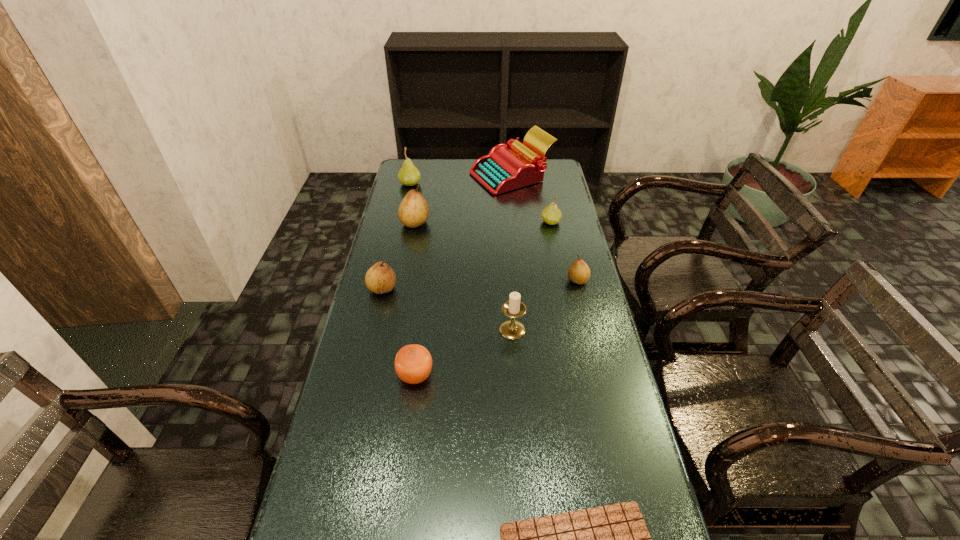
The height and width of the screenshot is (540, 960). Identify the location of orange orange. (413, 363).

Locate an element on the screen. the shortest pear is located at coordinates coord(579,272).

Where is `the rightmost brown pear`? The height and width of the screenshot is (540, 960). the rightmost brown pear is located at coordinates (579, 272).

This screenshot has width=960, height=540. In order to click on free location located 0.200m on the typing side of the typewriter in this screenshot , I will do `click(426, 176)`.

The image size is (960, 540). I want to click on free space located 0.130m on the typing side of the typewriter, so click(441, 176).

Find the location of `free space located on the typing side of the typewriter`. free space located on the typing side of the typewriter is located at coordinates (413, 176).

Find the location of a particular element. Image resolution: width=960 pixels, height=540 pixels. free spot located 0.140m on the back of the biggest brown pear is located at coordinates (420, 196).

Where is `vacant point located on the right of the left green pear`? This screenshot has height=540, width=960. vacant point located on the right of the left green pear is located at coordinates point(508,184).

Where is `free space located on the right of the white candle holder`? This screenshot has width=960, height=540. free space located on the right of the white candle holder is located at coordinates (559, 330).

Where is `free space located on the back of the second smallest brown pear`? The image size is (960, 540). free space located on the back of the second smallest brown pear is located at coordinates (394, 240).